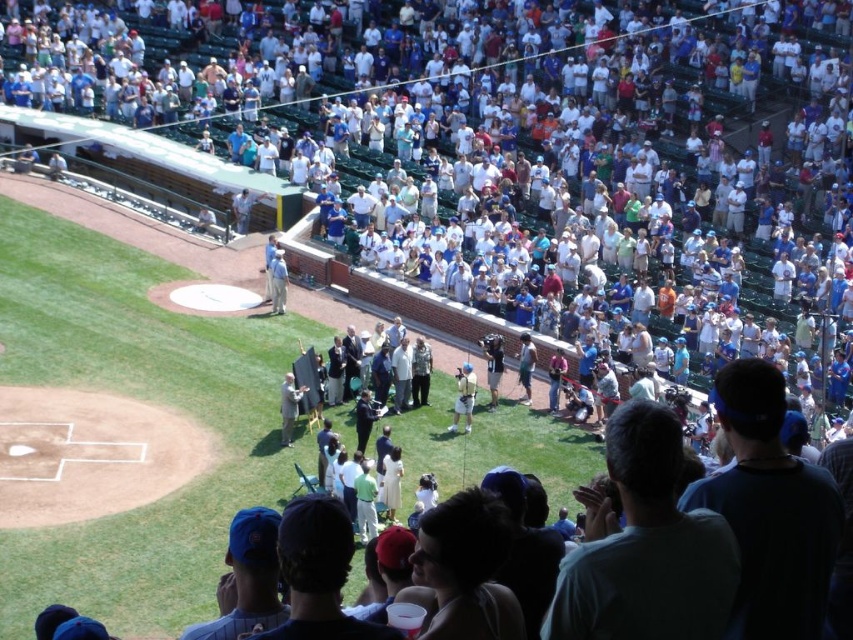
Question: Is white jersey at center in front of light gray fabric jacket at center?

Choices:
 (A) yes
 (B) no

Answer: (B)

Question: Which point is closer to the camera taking this photo?

Choices:
 (A) (466, 372)
 (B) (283, 284)
 (C) (283, 429)

Answer: (C)

Question: Can you confirm if white jersey at center is smaller than light gray fabric jacket at center?

Choices:
 (A) yes
 (B) no

Answer: (A)

Question: Which of the following is the closest to the observer?

Choices:
 (A) white jersey at center
 (B) light gray fabric jacket at center
 (C) white cotton shirt at center

Answer: (B)

Question: Among these objects, which one is farthest from the camera?

Choices:
 (A) white cotton shirt at center
 (B) light gray fabric jacket at center

Answer: (A)

Question: Can you confirm if light gray fabric jacket at center is positioned below white cotton shirt at center?

Choices:
 (A) yes
 (B) no

Answer: (A)